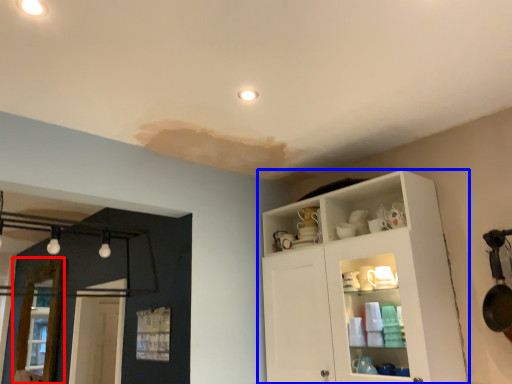
Question: Which point is further to the camera, screen door (highlighted by a red box) or cupboard (highlighted by a blue box)?

Choices:
 (A) screen door
 (B) cupboard

Answer: (A)